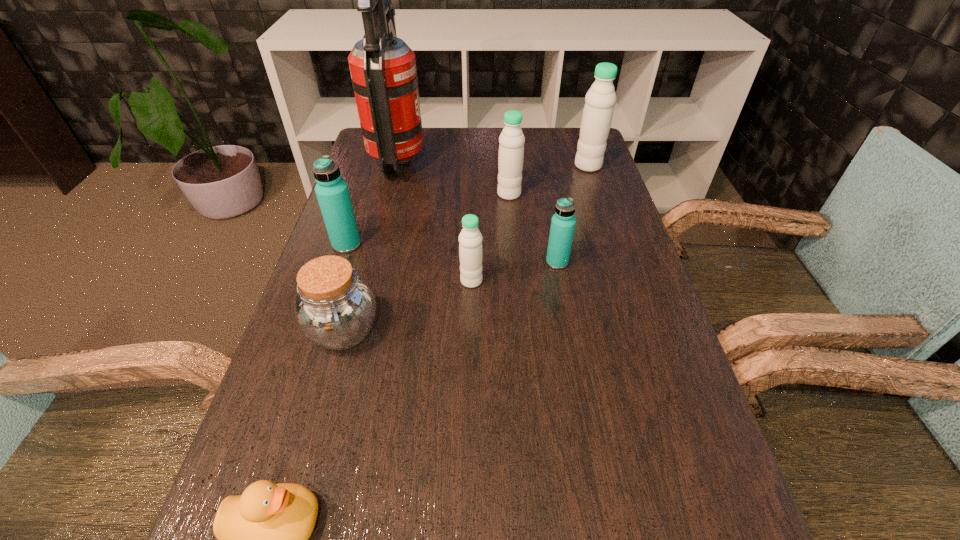
Locate an element on the screen. Image resolution: width=960 pixels, height=540 pixels. vacant area at the left edge is located at coordinates (337, 403).

In the image, there is a desktop. Identify the location of vacant space at the right edge. The height and width of the screenshot is (540, 960). (670, 465).

Where is `unoccupied area between the fire extinguisher and the biggest white water bottle`? This screenshot has height=540, width=960. unoccupied area between the fire extinguisher and the biggest white water bottle is located at coordinates (493, 164).

Where is `free point between the leftmost white water bottle and the leftmost water bottle`? This screenshot has height=540, width=960. free point between the leftmost white water bottle and the leftmost water bottle is located at coordinates (409, 263).

Locate an element on the screen. Image resolution: width=960 pixels, height=540 pixels. free space between the third nearest water bottle and the farthest white water bottle is located at coordinates (468, 205).

Where is `vacant area that lies between the biggest white water bottle and the sixth object from left to right`? vacant area that lies between the biggest white water bottle and the sixth object from left to right is located at coordinates (548, 180).

This screenshot has height=540, width=960. Find the location of `blank region between the red fire extinguisher and the second white water bottle from left to right`. blank region between the red fire extinguisher and the second white water bottle from left to right is located at coordinates (454, 178).

You are a GUI agent. You are given a task and a screenshot of the screen. Output one action in this format:
    pyautogui.click(x=<x>, y=<y>)
    Task: Click on the free space between the red fire extinguisher and the second farthest white water bottle
    
    Given the screenshot: What is the action you would take?
    pyautogui.click(x=454, y=178)

Locate which object is the fourth closest to the smallest white water bottle. Please provide its 2D coordinates. Your answer should be formatted as a tuple, i.e. [(x, y)], where the tuple contains the x and y coordinates of a point satisfying the conditions above.

[(511, 148)]

Identify which object is located as the fourth nearest to the tallest object. Please provide its 2D coordinates. Your answer should be formatted as a tuple, i.e. [(x, y)], where the tuple contains the x and y coordinates of a point satisfying the conditions above.

[(563, 222)]